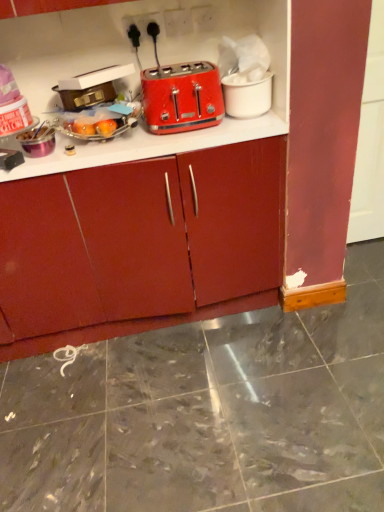
I want to click on free location in front of white matte cup at upper right, which is the first appliance in right-to-left order, so click(x=243, y=126).